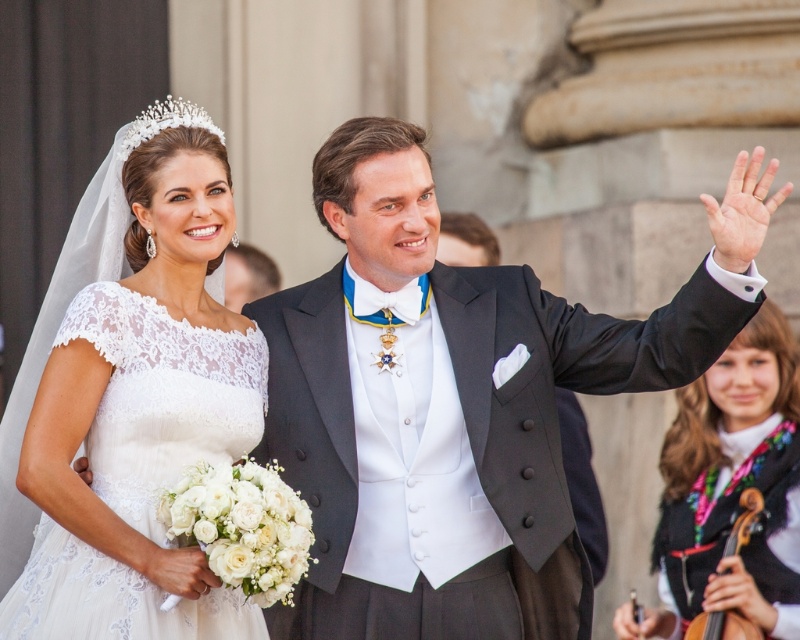
You are a photographer at a wedding. You need to decide where to place a step stool so both the white lace dress at left and the white lace dress at lower right can be seen clearly in the photo. Which dress requires the stool because it is shorter?

The white lace dress at left is shorter than the white lace dress at lower right, so the step stool should be placed under the white lace dress at left to ensure it is visible in the photo.